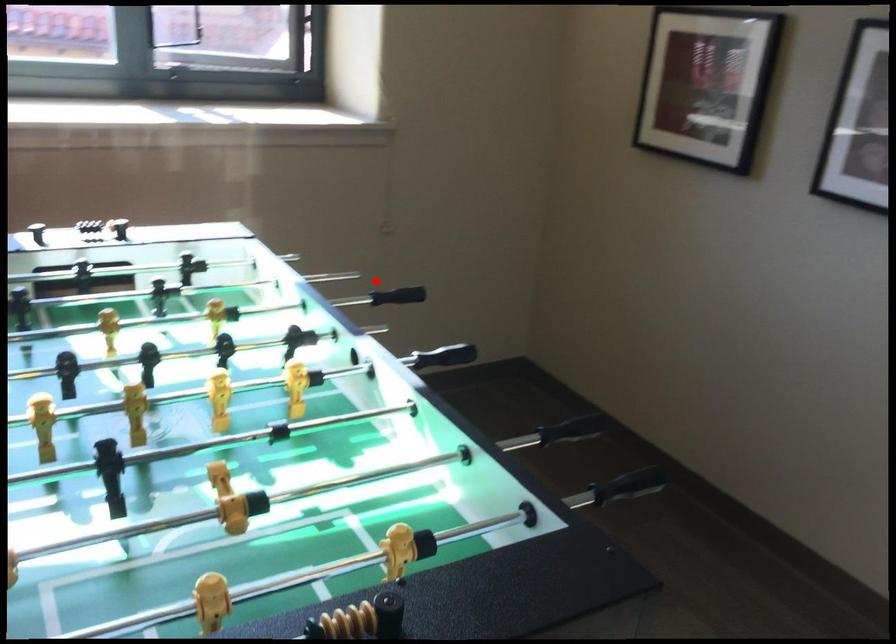
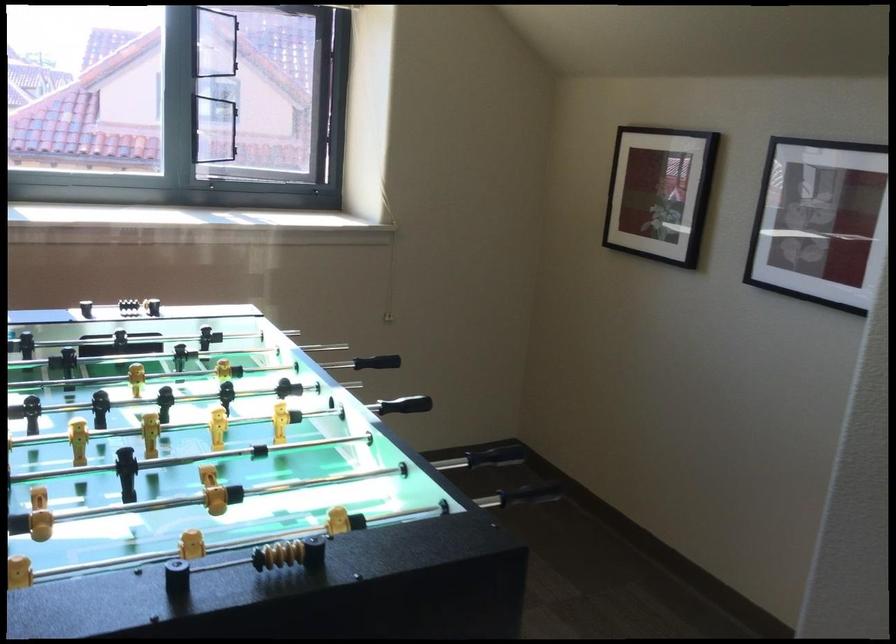
Question: A red point is marked in image1. In image2, is the corresponding 3D point closer to the camera or farther? Reply with the corresponding letter.

Choices:
 (A) The corresponding 3D point is closer.
 (B) The corresponding 3D point is farther.

Answer: (B)